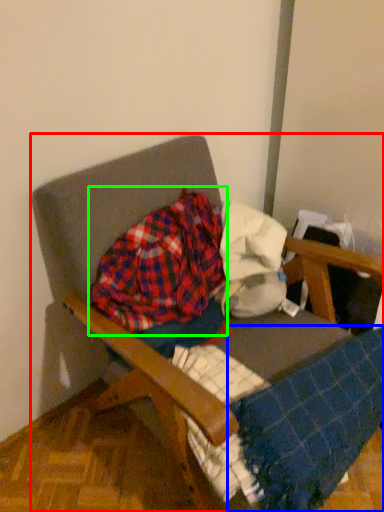
Question: Which object is the closest to the chair (highlighted by a red box)? Choose among these: blanket (highlighted by a blue box) or flannel (highlighted by a green box).

Choices:
 (A) blanket
 (B) flannel

Answer: (B)